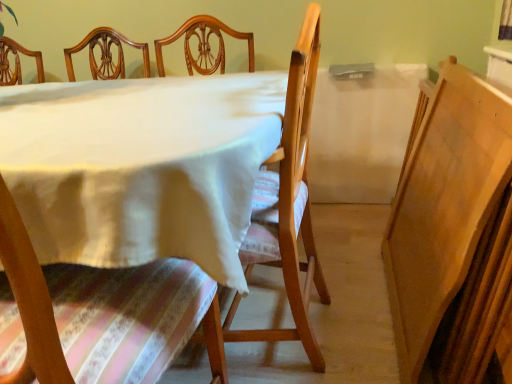
Image resolution: width=512 pixels, height=384 pixels. I want to click on white cloth at center, so click(x=140, y=167).

Does point (158, 351) lie in front of point (142, 183)?

That is False.

Where is `table beneath the wooden chair at center, the 1th chair from the left (from a real-world perspective)`? The height and width of the screenshot is (384, 512). table beneath the wooden chair at center, the 1th chair from the left (from a real-world perspective) is located at coordinates (140, 167).

Between wooden chair at center, positioned as the second chair in right-to-left order, and white cloth at center, which one has smaller width?

Thinner between the two is wooden chair at center, positioned as the second chair in right-to-left order.

Would you say wooden chair at center, acting as the first chair starting from the right, is to the left or to the right of wooden chair at center, the 1th chair from the left, in the picture?

wooden chair at center, acting as the first chair starting from the right, is positioned on wooden chair at center, the 1th chair from the left,'s right side.

Consider the image. Is wooden chair at center, arranged as the 2th chair when viewed from the left, taller than wooden chair at center, the 1th chair from the left?

Indeed, wooden chair at center, arranged as the 2th chair when viewed from the left, has a greater height compared to wooden chair at center, the 1th chair from the left.

Choose the correct answer: Is wooden chair at center, acting as the first chair starting from the right, inside wooden chair at center, positioned as the second chair in right-to-left order, or outside it?

wooden chair at center, acting as the first chair starting from the right, is outside wooden chair at center, positioned as the second chair in right-to-left order.

Is point (291, 285) closer or farther from the camera than point (94, 323)?

Clearly, point (291, 285) is more distant from the camera than point (94, 323).

In the scene shown: Which object is wider, wooden chair at center, arranged as the 2th chair when viewed from the left, or white cloth at center?

Wider between the two is white cloth at center.

Consider the image. Can white cloth at center be found inside wooden chair at center, arranged as the 2th chair when viewed from the left?

No, white cloth at center is located outside of wooden chair at center, arranged as the 2th chair when viewed from the left.

Is wooden chair at center, arranged as the 2th chair when viewed from the left, touching white cloth at center?

wooden chair at center, arranged as the 2th chair when viewed from the left, is not next to white cloth at center, and they're not touching.

Is wooden chair at center, the 1th chair from the left, thinner than wooden chair at center, arranged as the 2th chair when viewed from the left?

No, wooden chair at center, the 1th chair from the left, is not thinner than wooden chair at center, arranged as the 2th chair when viewed from the left.

Relative to wooden chair at center, acting as the first chair starting from the right, is wooden chair at center, positioned as the second chair in right-to-left order, in front or behind?

Clearly, wooden chair at center, positioned as the second chair in right-to-left order, is in front of wooden chair at center, acting as the first chair starting from the right.

Are wooden chair at center, the 1th chair from the left, and wooden chair at center, arranged as the 2th chair when viewed from the left, located far from each other?

That's not correct — wooden chair at center, the 1th chair from the left, is a little close to wooden chair at center, arranged as the 2th chair when viewed from the left.

I want to click on chair located behind the wooden chair at center, positioned as the second chair in right-to-left order, so click(x=288, y=206).

From a real-world perspective, is white cloth at center above or below wooden chair at center, positioned as the second chair in right-to-left order?

white cloth at center is below wooden chair at center, positioned as the second chair in right-to-left order.

Considering the relative sizes of white cloth at center and wooden chair at center, the 1th chair from the left, in the image provided, is white cloth at center smaller than wooden chair at center, the 1th chair from the left,?

No, white cloth at center is not smaller than wooden chair at center, the 1th chair from the left.

Can you tell me how much white cloth at center and wooden chair at center, the 1th chair from the left, differ in facing direction?

91.1 degrees.

Considering the sizes of white cloth at center and wooden chair at center, acting as the first chair starting from the right, in the image, is white cloth at center taller or shorter than wooden chair at center, acting as the first chair starting from the right,?

Considering their sizes, white cloth at center has less height than wooden chair at center, acting as the first chair starting from the right.

Which of these two, white cloth at center or wooden chair at center, acting as the first chair starting from the right, is smaller?

wooden chair at center, acting as the first chair starting from the right, is smaller.

Is white cloth at center facing away from wooden chair at center, acting as the first chair starting from the right?

white cloth at center is not turned away from wooden chair at center, acting as the first chair starting from the right.

Are white cloth at center and wooden chair at center, arranged as the 2th chair when viewed from the left, beside each other?

No.

At what (x,y) coordinates should I click in order to perform the action: click on chair that is below the white cloth at center (from the image's perspective). Please return your answer as a coordinate pair (x, y). The image size is (512, 384). Looking at the image, I should click on (99, 313).

Locate an element on the screen. chair above the wooden chair at center, acting as the first chair starting from the right (from a real-world perspective) is located at coordinates (99, 313).

When comparing their distances from wooden chair at center, the 1th chair from the left, does wooden chair at center, acting as the first chair starting from the right, or white cloth at center seem closer?

Among the two, white cloth at center is located nearer to wooden chair at center, the 1th chair from the left.

Which object lies nearer to the anchor point white cloth at center, wooden chair at center, positioned as the second chair in right-to-left order, or wooden chair at center, acting as the first chair starting from the right?

wooden chair at center, positioned as the second chair in right-to-left order, lies closer to white cloth at center than the other object.

Estimate the real-world distances between objects in this image. Which object is further from wooden chair at center, acting as the first chair starting from the right, white cloth at center or wooden chair at center, positioned as the second chair in right-to-left order?

Among the two, wooden chair at center, positioned as the second chair in right-to-left order, is located further to wooden chair at center, acting as the first chair starting from the right.

Looking at the image, which one is located further to wooden chair at center, positioned as the second chair in right-to-left order, white cloth at center or wooden chair at center, arranged as the 2th chair when viewed from the left?

wooden chair at center, arranged as the 2th chair when viewed from the left, is positioned further to the anchor wooden chair at center, positioned as the second chair in right-to-left order.

Looking at the image, which one is located further to wooden chair at center, arranged as the 2th chair when viewed from the left, wooden chair at center, the 1th chair from the left, or white cloth at center?

wooden chair at center, the 1th chair from the left.

Which object lies further to the anchor point white cloth at center, wooden chair at center, acting as the first chair starting from the right, or wooden chair at center, positioned as the second chair in right-to-left order?

wooden chair at center, acting as the first chair starting from the right, is positioned further to the anchor white cloth at center.

This screenshot has height=384, width=512. I want to click on chair between white cloth at center and wooden chair at center, acting as the first chair starting from the right, from left to right, so click(x=99, y=313).